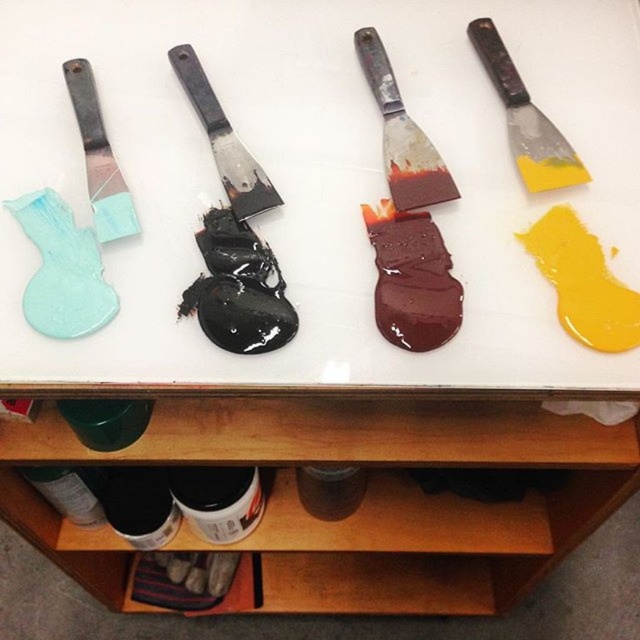
Question: Which point is farther from the camera taking this photo?

Choices:
 (A) (212, 120)
 (B) (360, 51)
 (C) (125, 228)

Answer: (B)

Question: Observing the image, what is the correct spatial positioning of satin red spatula at center in reference to black matte spatula at center?

Choices:
 (A) below
 (B) above

Answer: (B)

Question: Is yellow matte spatula at upper right to the right of matte plastic spatula at left from the viewer's perspective?

Choices:
 (A) no
 (B) yes

Answer: (B)

Question: Is yellow matte spatula at upper right to the right of matte plastic spatula at left from the viewer's perspective?

Choices:
 (A) yes
 (B) no

Answer: (A)

Question: Among these points, which one is farthest from the camera?

Choices:
 (A) (189, 61)
 (B) (102, 234)
 (C) (404, 180)

Answer: (A)

Question: Which of the following is the closest to the observer?

Choices:
 (A) matte plastic spatula at left
 (B) satin red spatula at center
 (C) yellow matte spatula at upper right
 (D) black matte spatula at center

Answer: (A)